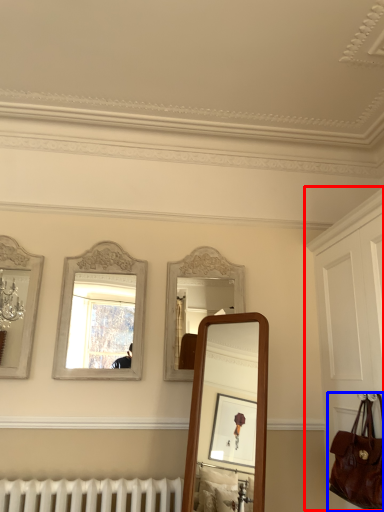
Question: Which point is closer to the camera, dresser (highlighted by a red box) or handbag (highlighted by a blue box)?

Choices:
 (A) dresser
 (B) handbag

Answer: (A)